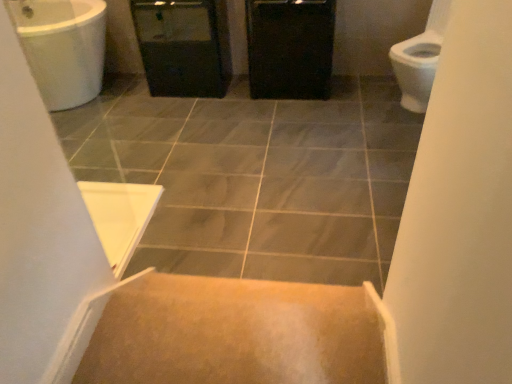
Question: Considering the relative sizes of black plastic screen door at center and carpeted stairs at center in the image provided, is black plastic screen door at center taller than carpeted stairs at center?

Choices:
 (A) yes
 (B) no

Answer: (A)

Question: Does black plastic screen door at center lie in front of carpeted stairs at center?

Choices:
 (A) no
 (B) yes

Answer: (A)

Question: Is carpeted stairs at center inside black plastic screen door at center?

Choices:
 (A) yes
 (B) no

Answer: (B)

Question: Is black plastic screen door at center further to the viewer compared to carpeted stairs at center?

Choices:
 (A) no
 (B) yes

Answer: (B)

Question: Can you confirm if black plastic screen door at center is wider than carpeted stairs at center?

Choices:
 (A) no
 (B) yes

Answer: (B)

Question: From a real-world perspective, is black matte cabinet at center above or below black plastic screen door at center?

Choices:
 (A) below
 (B) above

Answer: (A)

Question: Is black matte cabinet at center to the left or to the right of black plastic screen door at center in the image?

Choices:
 (A) left
 (B) right

Answer: (B)

Question: Relative to black plastic screen door at center, is black matte cabinet at center in front or behind?

Choices:
 (A) front
 (B) behind

Answer: (A)

Question: Is black matte cabinet at center taller or shorter than black plastic screen door at center?

Choices:
 (A) short
 (B) tall

Answer: (A)

Question: Is black plastic screen door at center in front of or behind gray tile at center in the image?

Choices:
 (A) behind
 (B) front

Answer: (A)

Question: In terms of width, does black plastic screen door at center look wider or thinner when compared to gray tile at center?

Choices:
 (A) wide
 (B) thin

Answer: (B)

Question: Is point (196, 26) closer or farther from the camera than point (380, 276)?

Choices:
 (A) farther
 (B) closer

Answer: (A)

Question: From the image's perspective, is black plastic screen door at center above or below gray tile at center?

Choices:
 (A) below
 (B) above

Answer: (B)

Question: From a real-world perspective, is gray tile at center positioned above or below black matte cabinet at center?

Choices:
 (A) below
 (B) above

Answer: (A)

Question: Relative to black matte cabinet at center, is gray tile at center in front or behind?

Choices:
 (A) behind
 (B) front

Answer: (B)